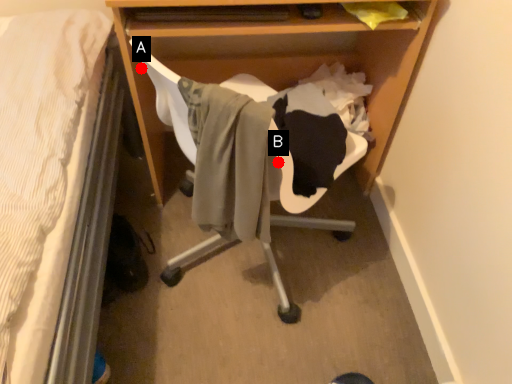
Question: Two points are circled on the image, labeled by A and B beside each circle. Which point is closer to the camera taking this photo?

Choices:
 (A) A is closer
 (B) B is closer

Answer: (B)